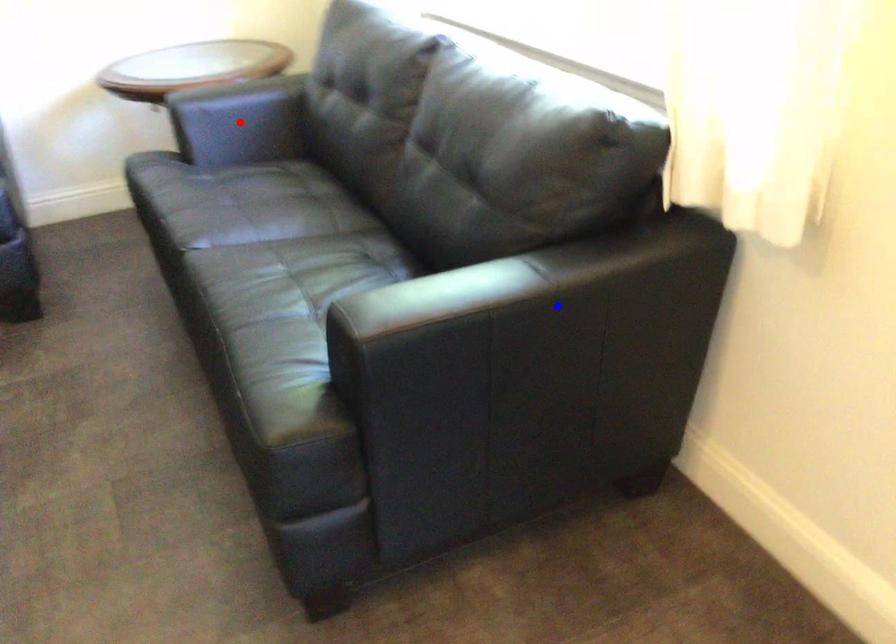
Question: In the image, two points are highlighted. Which point is nearer to the camera? Reply with the corresponding letter.

Choices:
 (A) blue point
 (B) red point

Answer: (A)